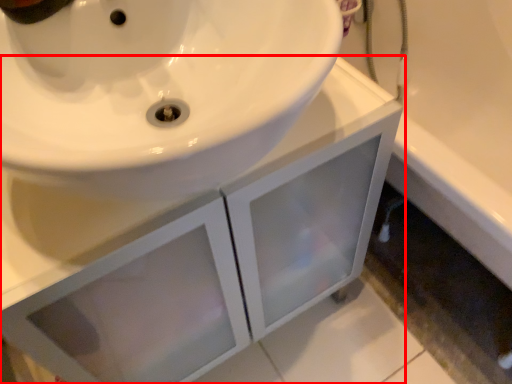
Question: Where is bathroom cabinet (annotated by the red box) located in relation to bath in the image?

Choices:
 (A) left
 (B) right

Answer: (A)